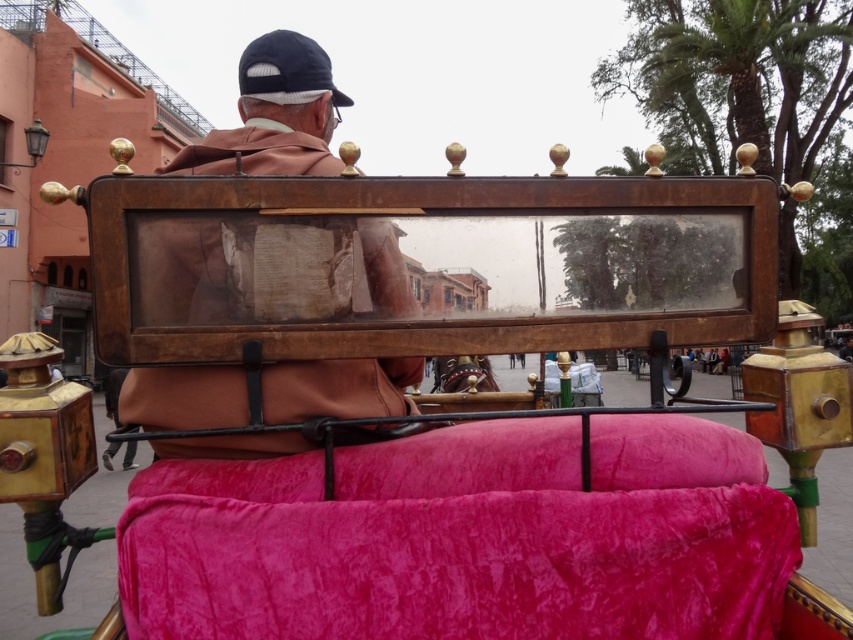
From the picture: You are a passenger in the horse drawn carriage and want to cover yourself with the blanket. Can the velvet pink blanket at center cover the brown leather jacket at upper center?

The velvet pink blanket at center is wider than the brown leather jacket at upper center, so yes, the blanket can cover the jacket.

You are a passenger in the horse drawn carriage and you want to place your phone on the velvet pink blanket at center and the brown leather jacket at upper center. Which surface is on the right side?

The velvet pink blanket at center is positioned on the right side of brown leather jacket at upper center, so you should place your phone on the velvet pink blanket at center to have it on the right side.